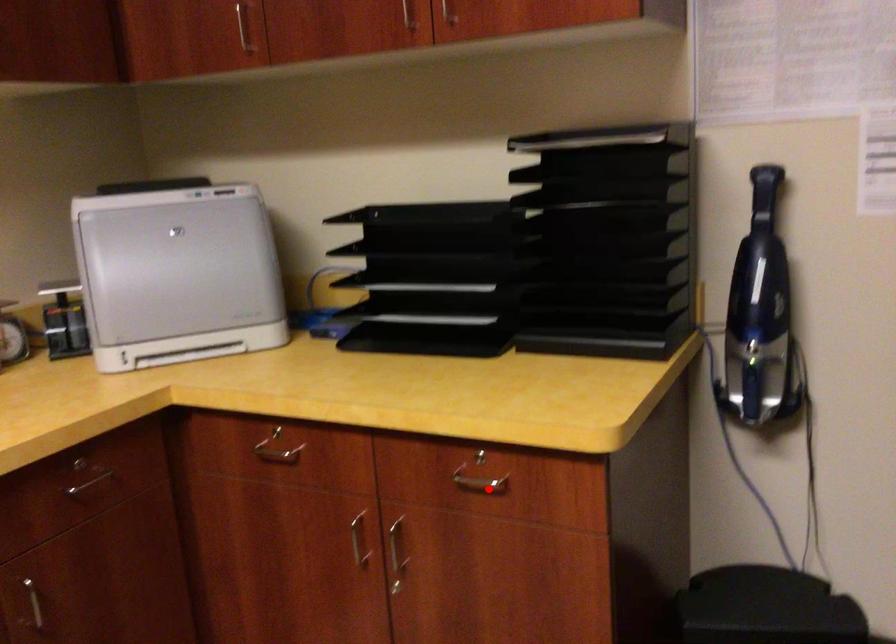
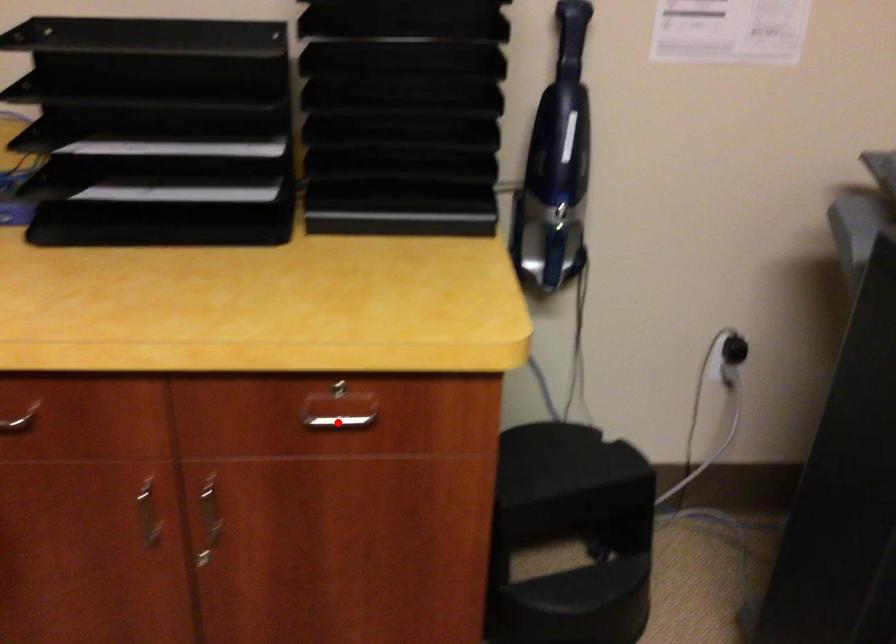
I am providing you with two images of the same scene from different viewpoints. A red point is marked on the first image and another point is marked on the second image. Are the points marked in image1 and image2 representing the same 3D position?

Yes